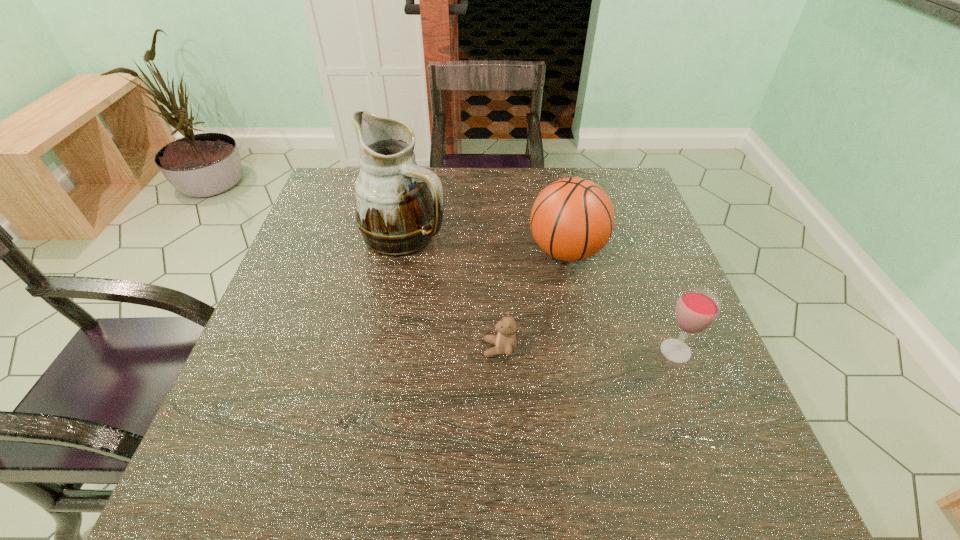
Identify the location of vacant space at the near edge of the desktop. (326, 487).

The width and height of the screenshot is (960, 540). In the image, there is a desktop. Identify the location of free region at the left edge. (310, 413).

Locate an element on the screen. Image resolution: width=960 pixels, height=540 pixels. vacant area at the right edge of the desktop is located at coordinates (654, 305).

The width and height of the screenshot is (960, 540). In order to click on free space at the near left corner of the desktop in this screenshot , I will do `click(203, 469)`.

This screenshot has height=540, width=960. What are the coordinates of `free space at the far right corner of the desktop` in the screenshot? It's located at (646, 214).

I want to click on vacant position at the near right corner of the desktop, so click(x=681, y=505).

The height and width of the screenshot is (540, 960). I want to click on free spot between the shortest object and the rightmost object, so click(588, 350).

This screenshot has width=960, height=540. In order to click on free area in between the third tallest object and the tallest object in this screenshot , I will do `click(540, 293)`.

Image resolution: width=960 pixels, height=540 pixels. Find the location of `vacant region between the basketball and the leftmost object`. vacant region between the basketball and the leftmost object is located at coordinates (486, 243).

What are the coordinates of `vacant area between the leftmost object and the second object from right to left` in the screenshot? It's located at (486, 243).